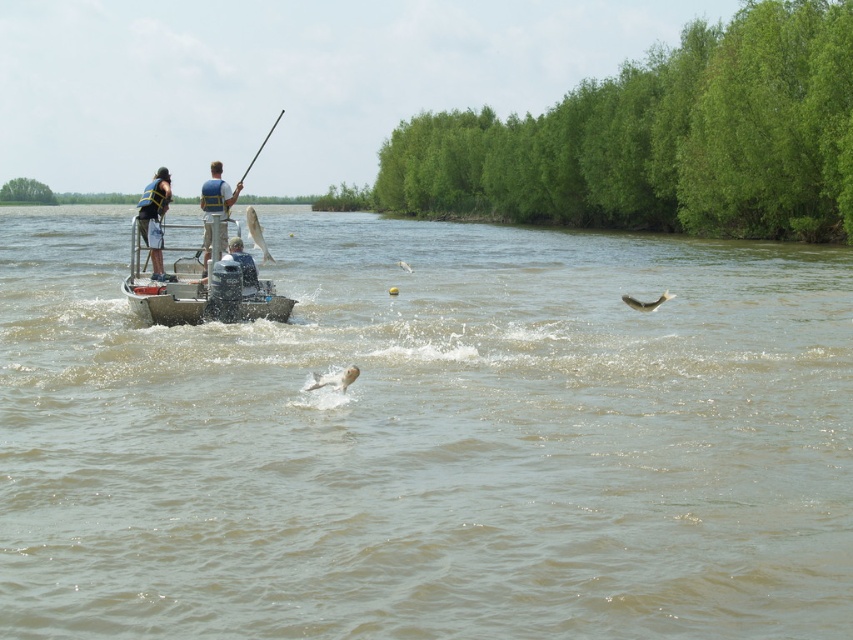
You are a safety inspector checking the boat for proper equipment. The light blue life vest at center and the gray fabric shirt at center are both visible. Which item is taller?

The light blue life vest at center is taller than the gray fabric shirt at center.

You are a passenger on the metallic gray boat at center and want to retrieve your light blue life vest at center. Which direction should you move to reach it?

The metallic gray boat at center is positioned on the right side of the light blue life vest at center, so you should move to your left to reach it.

You are standing on the dock and see the point at coordinates (199, 294). Which object is that point located on?

The point at coordinates (199, 294) is located on the metallic gray boat at center.